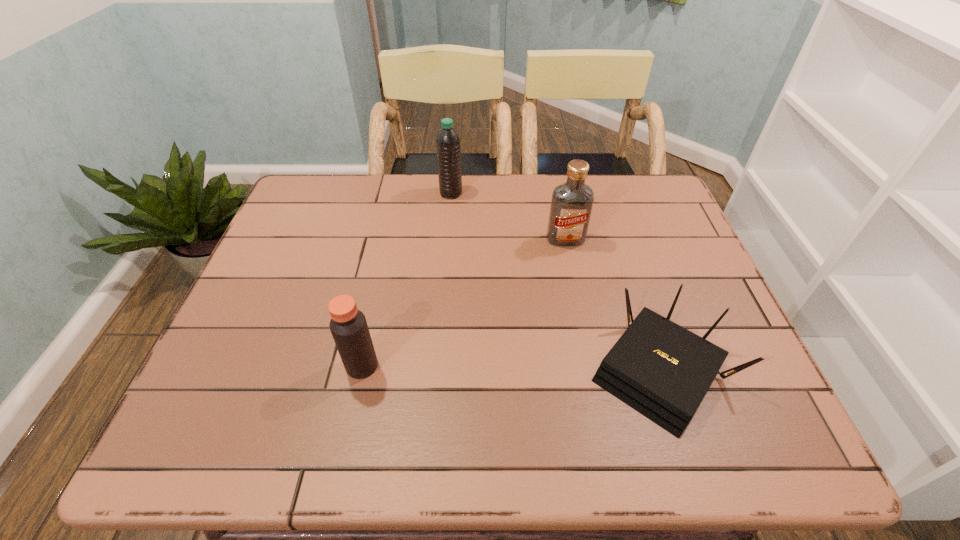
The width and height of the screenshot is (960, 540). I want to click on object that is at the far edge, so click(x=448, y=146).

Locate an element on the screen. The height and width of the screenshot is (540, 960). object situated at the near edge is located at coordinates (660, 369).

The width and height of the screenshot is (960, 540). In order to click on object located in the right edge section of the desktop in this screenshot , I will do `click(660, 369)`.

Where is `object at the near right corner`? The height and width of the screenshot is (540, 960). object at the near right corner is located at coordinates (660, 369).

You are a GUI agent. You are given a task and a screenshot of the screen. Output one action in this format:
    pyautogui.click(x=<x>, y=<y>)
    Task: Click on the vacant space at the far edge of the desktop
    The width and height of the screenshot is (960, 540).
    Given the screenshot: What is the action you would take?
    pyautogui.click(x=564, y=179)

Where is `free region at the near edge of the desktop`? free region at the near edge of the desktop is located at coordinates (332, 431).

In the image, there is a desktop. At what (x,y) coordinates should I click in order to perform the action: click on free space at the left edge. Please return your answer as a coordinate pair (x, y). Looking at the image, I should click on (271, 283).

Identify the location of vacant area at the right edge of the desktop. The image size is (960, 540). (626, 228).

Locate an element on the screen. Image resolution: width=960 pixels, height=540 pixels. vacant space at the near left corner is located at coordinates (202, 441).

Locate an element on the screen. vacant region at the far right corner of the desktop is located at coordinates pyautogui.click(x=651, y=199).